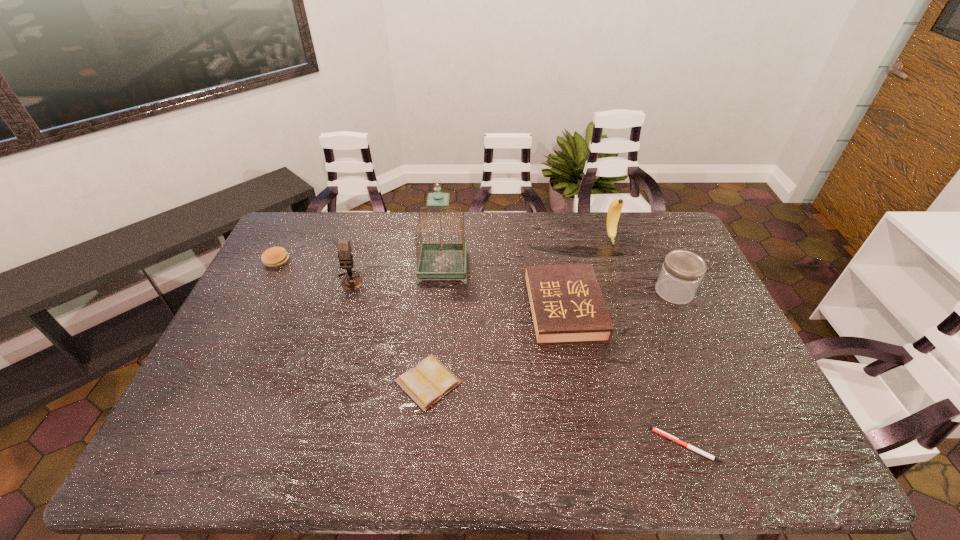
Where is `vacant space located on the clicker of the pen`? The image size is (960, 540). vacant space located on the clicker of the pen is located at coordinates (510, 446).

Identify the location of vacant space located on the clicker of the pen. The height and width of the screenshot is (540, 960). (489, 446).

This screenshot has width=960, height=540. I want to click on vacant space situated 0.050m on the clicker of the pen, so click(633, 446).

At what (x,y) coordinates should I click in order to perform the action: click on object situated at the far edge. Please return your answer as a coordinate pair (x, y). Looking at the image, I should click on (614, 210).

The image size is (960, 540). I want to click on object that is at the near edge, so click(x=656, y=430).

The width and height of the screenshot is (960, 540). Find the location of `object present at the left edge`. object present at the left edge is located at coordinates (274, 257).

Where is `object located at the right edge`? Image resolution: width=960 pixels, height=540 pixels. object located at the right edge is located at coordinates (682, 271).

In the image, there is a desktop. At what (x,y) coordinates should I click in order to perform the action: click on free region at the far edge. Please return your answer as a coordinate pair (x, y). Looking at the image, I should click on (341, 235).

The image size is (960, 540). I want to click on vacant space at the near edge of the desktop, so click(x=596, y=456).

Where is `vacant space at the left edge of the desktop`? The image size is (960, 540). vacant space at the left edge of the desktop is located at coordinates (231, 373).